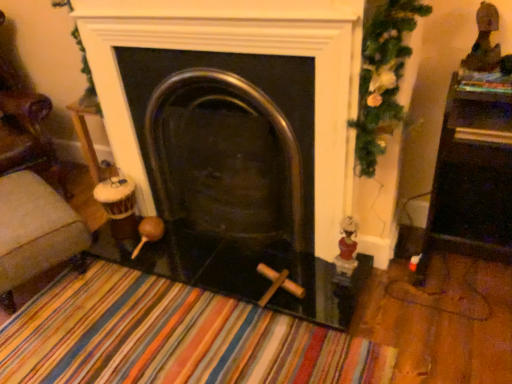
Question: Is velvet beige ottoman at left spatially inside polished metal fireplace at center, or outside of it?

Choices:
 (A) inside
 (B) outside

Answer: (B)

Question: Does point (75, 243) appear closer or farther from the camera than point (224, 216)?

Choices:
 (A) closer
 (B) farther

Answer: (A)

Question: Estimate the real-world distances between objects in this image. Which object is closer to the green textured garland at upper right?

Choices:
 (A) polished metal fireplace at center
 (B) shiny dark brown statue at upper right, arranged as the second toy when ordered from the bottom
 (C) white porcelain figurine at right, the first toy in the left-to-right sequence
 (D) velvet beige ottoman at left

Answer: (B)

Question: Which is nearer to the green textured garland at upper right?

Choices:
 (A) white porcelain figurine at right, the second toy from the right
 (B) shiny dark brown statue at upper right, which is the 2th toy from left to right
 (C) polished metal fireplace at center
 (D) velvet beige ottoman at left

Answer: (B)